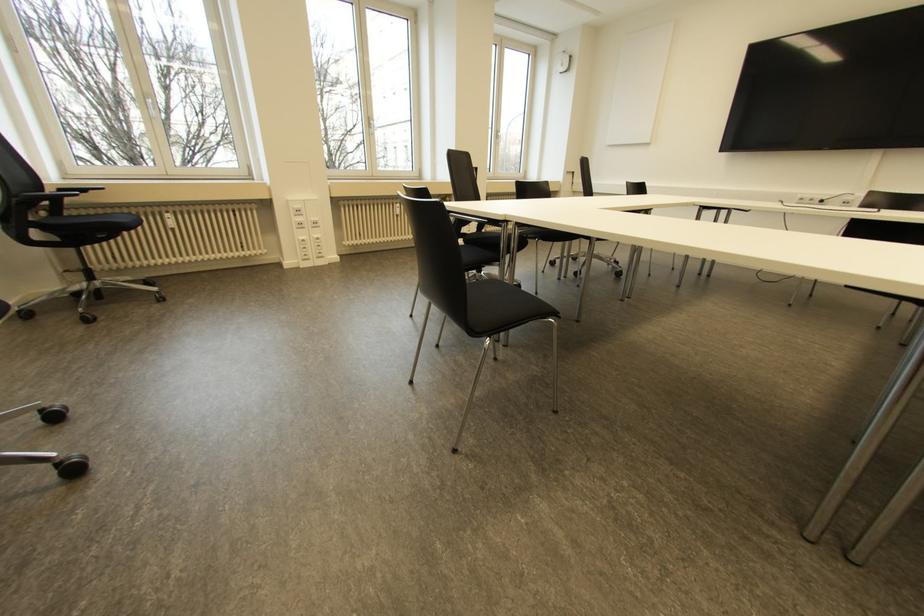
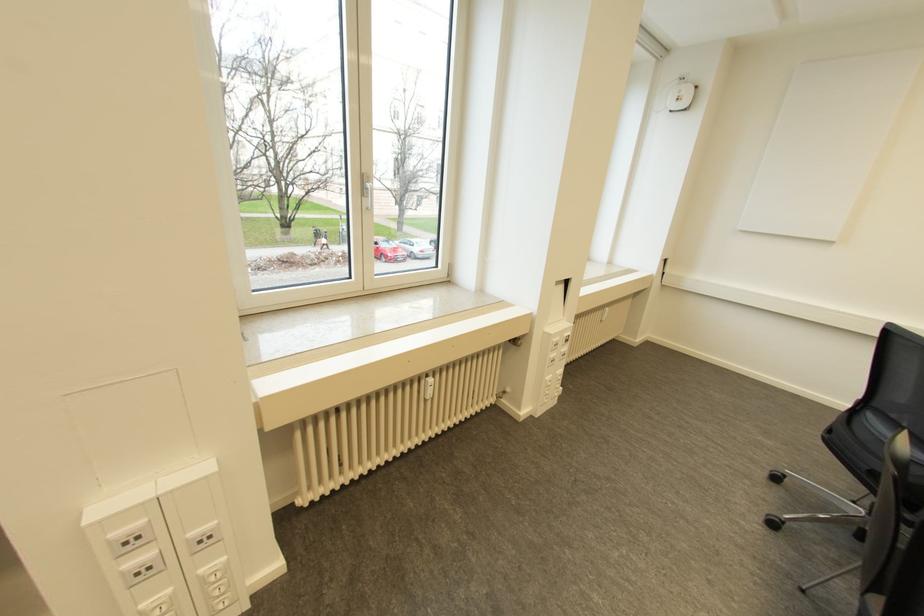
Find the pixel in the second image that matches (x=397, y=204) in the first image.

(430, 379)